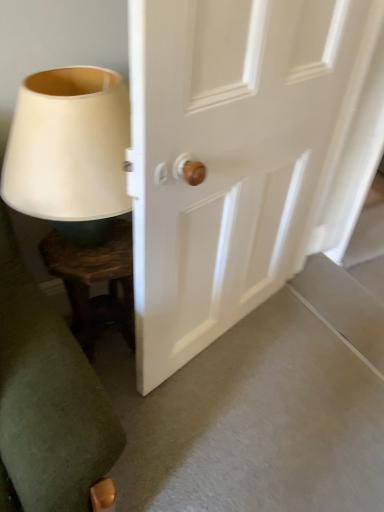
What is the approximate height of matte white lampshade at left?

matte white lampshade at left is 17.42 inches tall.

Find the location of a particular element. matte white lampshade at left is located at coordinates (69, 150).

Identify the location of matte white lampshade at left. (69, 150).

Between white wooden door at center and dark wood side table at lower left, which one has more height?

white wooden door at center.

From the image's perspective, would you say white wooden door at center is shown under dark wood side table at lower left?

No.

Could you tell me if white wooden door at center is turned towards dark wood side table at lower left?

No, white wooden door at center does not turn towards dark wood side table at lower left.

In the image, is matte white lampshade at left on the left side or the right side of dark wood side table at lower left?

In the image, matte white lampshade at left appears on the left side of dark wood side table at lower left.

Considering the sizes of matte white lampshade at left and dark wood side table at lower left in the image, is matte white lampshade at left taller or shorter than dark wood side table at lower left?

Answer: Considering their sizes, matte white lampshade at left has less height than dark wood side table at lower left.

Do you think matte white lampshade at left is within dark wood side table at lower left, or outside of it?

matte white lampshade at left is not enclosed by dark wood side table at lower left.

Are matte white lampshade at left and dark wood side table at lower left located far from each other?

No, matte white lampshade at left is in close proximity to dark wood side table at lower left.

Is white wooden door at center thinner than matte white lampshade at left?

Yes.

Which object is positioned more to the left, white wooden door at center or matte white lampshade at left?

matte white lampshade at left.

From the image's perspective, does white wooden door at center appear lower than matte white lampshade at left?

Yes.

From the picture: Is white wooden door at center facing away from matte white lampshade at left?

Yes, white wooden door at center's orientation is away from matte white lampshade at left.

Is dark wood side table at lower left oriented away from matte white lampshade at left?

dark wood side table at lower left is not turned away from matte white lampshade at left.

Considering the relative sizes of dark wood side table at lower left and matte white lampshade at left in the image provided, is dark wood side table at lower left shorter than matte white lampshade at left?

In fact, dark wood side table at lower left may be taller than matte white lampshade at left.

From the image's perspective, would you say dark wood side table at lower left is positioned over matte white lampshade at left?

No.

Is white wooden door at center at the back of matte white lampshade at left?

No, white wooden door at center is not at the back of matte white lampshade at left.

From the image's perspective, is matte white lampshade at left over white wooden door at center?

Correct, matte white lampshade at left appears higher than white wooden door at center in the image.

Identify the location of table lamp located on the left of white wooden door at center. This screenshot has width=384, height=512. (69, 150).

Is dark wood side table at lower left facing away from white wooden door at center?

No, dark wood side table at lower left is not facing away from white wooden door at center.

In the image, there is a dark wood side table at lower left. Where is `door above it (from the image's perspective)`? This screenshot has height=512, width=384. door above it (from the image's perspective) is located at coordinates pyautogui.click(x=229, y=156).

From a real-world perspective, is dark wood side table at lower left above or below white wooden door at center?

From a real-world perspective, dark wood side table at lower left is physically below white wooden door at center.

Do you think dark wood side table at lower left is within white wooden door at center, or outside of it?

dark wood side table at lower left is outside white wooden door at center.

Find the location of `door that is in front of the dark wood side table at lower left`. door that is in front of the dark wood side table at lower left is located at coordinates (229, 156).

Locate an element on the screen. This screenshot has width=384, height=512. furniture to the right of matte white lampshade at left is located at coordinates [95, 282].

Which object lies nearer to the anchor point white wooden door at center, dark wood side table at lower left or matte white lampshade at left?

Among the two, matte white lampshade at left is located nearer to white wooden door at center.

From the image, which object appears to be nearer to dark wood side table at lower left, matte white lampshade at left or white wooden door at center?

matte white lampshade at left.

Estimate the real-world distances between objects in this image. Which object is further from matte white lampshade at left, dark wood side table at lower left or white wooden door at center?

white wooden door at center is positioned further to the anchor matte white lampshade at left.

Estimate the real-world distances between objects in this image. Which object is closer to white wooden door at center, matte white lampshade at left or dark wood side table at lower left?

Among the two, matte white lampshade at left is located nearer to white wooden door at center.

Based on the photo, based on their spatial positions, is white wooden door at center or dark wood side table at lower left further from matte white lampshade at left?

white wooden door at center is positioned further to the anchor matte white lampshade at left.

When comparing their distances from dark wood side table at lower left, does white wooden door at center or matte white lampshade at left seem closer?

matte white lampshade at left.

What are the coordinates of `furniture between matte white lampshade at left and white wooden door at center from left to right` in the screenshot? It's located at (95, 282).